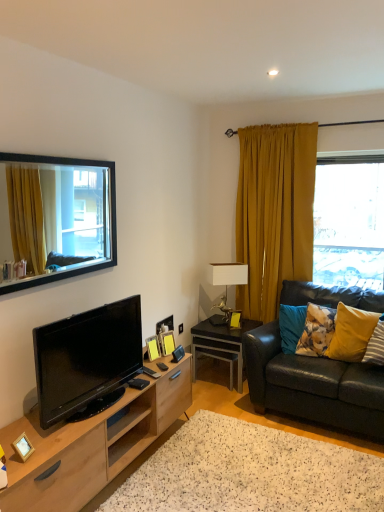
Image resolution: width=384 pixels, height=512 pixels. Identify the location of free space behind wooden picture frame at lower left, acting as the 1th picture frame starting from the left. (58, 437).